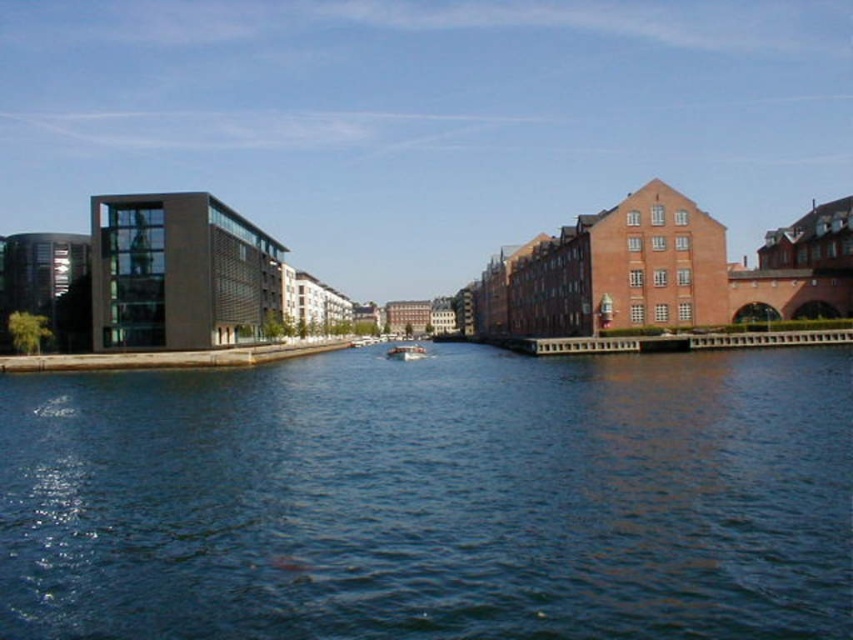
You are a photographer planning to capture the entire scene in one shot. The white plastic boat at center is currently in the middle of the dark blue water at center. To ensure both the boat and the water are fully visible, should you adjust your camera angle to focus more on the water or the boat?

The dark blue water at center is wider than the white plastic boat at center, so focusing on the water would ensure both elements are visible without cropping either.

You are a photographer planning to capture the reflection of the modern building on the dark blue water at center. However, you notice the white plastic boat at center is currently blocking the view. To ensure the reflection is visible, should you position yourself upstream or downstream of the boat?

Since the dark blue water at center is positioned under the white plastic boat at center, positioning yourself downstream of the boat would allow you to see the reflection of the modern building on the water without the boat obstructing the view.

You are standing at the waterfront and see two points in the scene. The first point is labeled as point (434, 486), and the second point is labeled as point (404, 353). Which of these two points is closer to you?

Point (434, 486) is closer to the viewer than point (404, 353).